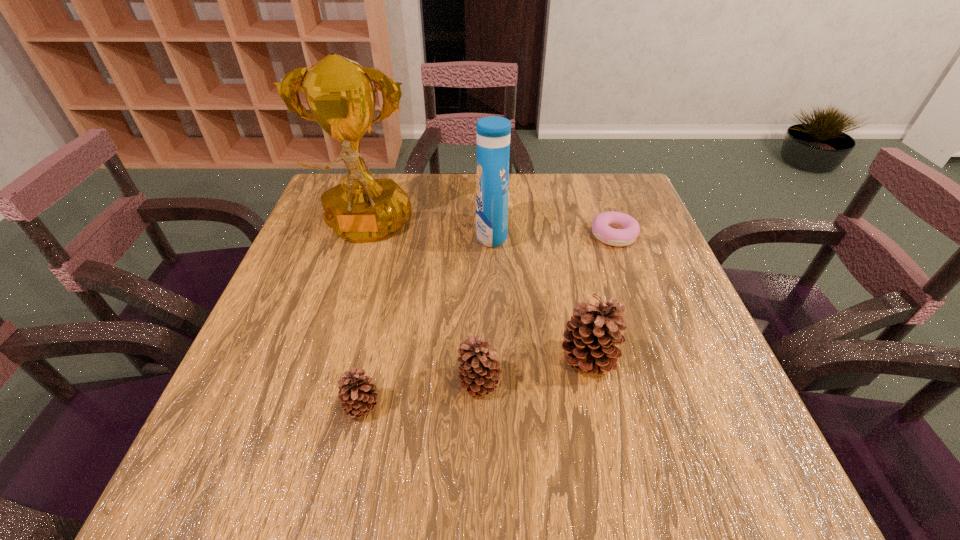
You are a GUI agent. You are given a task and a screenshot of the screen. Output one action in this format:
    pyautogui.click(x=<x>, y=<y>)
    Task: Click on the vacant space that satisfies the following two spatial constraints: 1. on the front-facing side of the fifth shortest object; 2. on the back side of the pastry
    This screenshot has height=540, width=960.
    Given the screenshot: What is the action you would take?
    pyautogui.click(x=492, y=235)